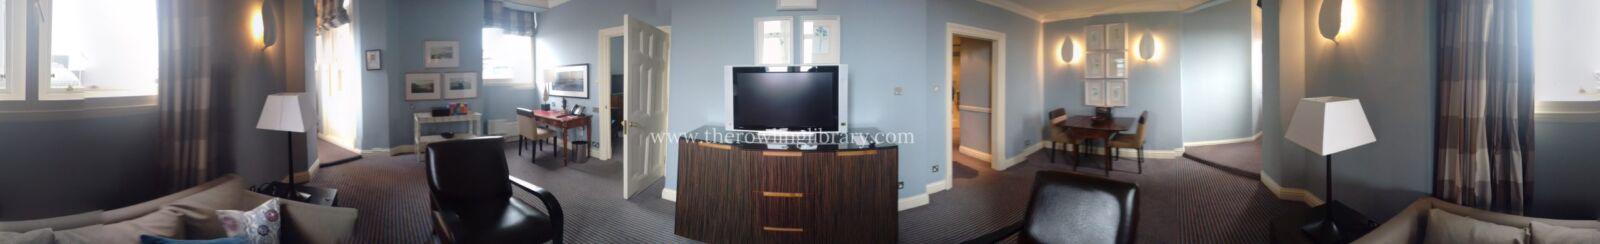
I want to click on table lamps, so click(x=1331, y=138), click(x=290, y=120).